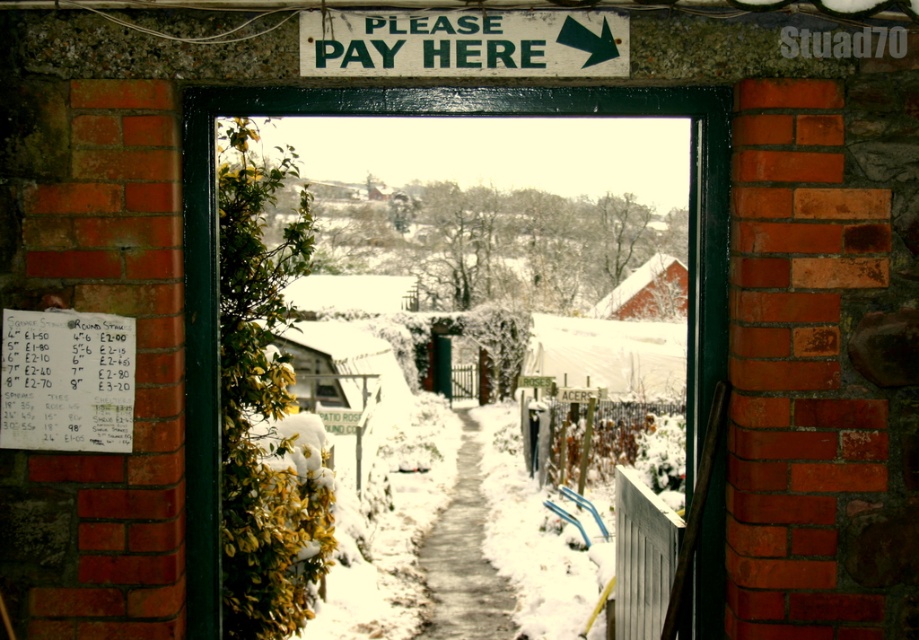
Does green wooden door at center appear over green painted wooden sign at upper center?

No, green wooden door at center is not above green painted wooden sign at upper center.

Is the position of green wooden door at center less distant than that of green painted wooden sign at upper center?

That is False.

What do you see at coordinates (428, 115) in the screenshot? The height and width of the screenshot is (640, 919). I see `green wooden door at center` at bounding box center [428, 115].

The image size is (919, 640). I want to click on green wooden door at center, so click(428, 115).